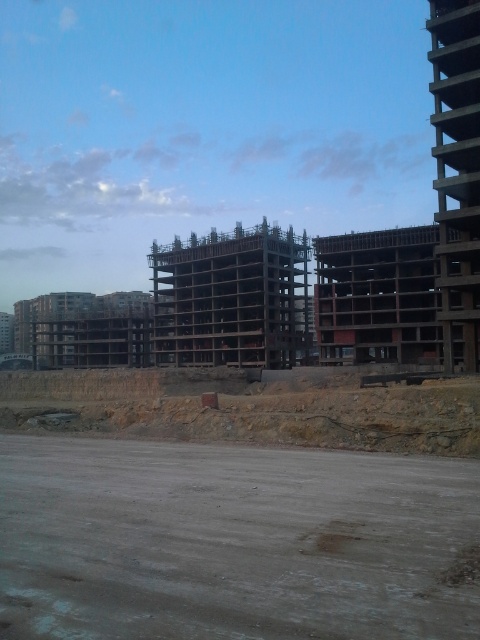
Question: Can you confirm if dirt at center is positioned to the left of dark wood building at center?

Choices:
 (A) no
 (B) yes

Answer: (A)

Question: Which of these objects is positioned closest to the wooden frame building at center?

Choices:
 (A) dark wood building at center
 (B) dirt at center

Answer: (A)

Question: Based on their relative distances, which object is farther from the dirt at center?

Choices:
 (A) wooden frame building at center
 (B) dark wood building at center

Answer: (B)

Question: Is dirt at center in front of dark wood building at center?

Choices:
 (A) yes
 (B) no

Answer: (A)

Question: Is dark wood building at center further to the viewer compared to wooden frame building at center?

Choices:
 (A) yes
 (B) no

Answer: (A)

Question: Among these points, which one is nearest to the camera?

Choices:
 (A) (380, 570)
 (B) (429, 234)

Answer: (A)